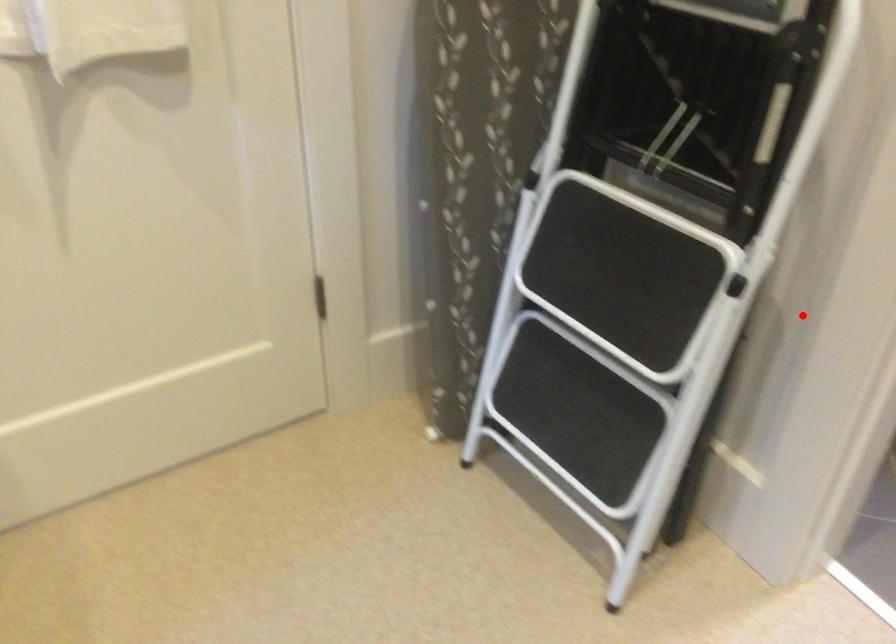
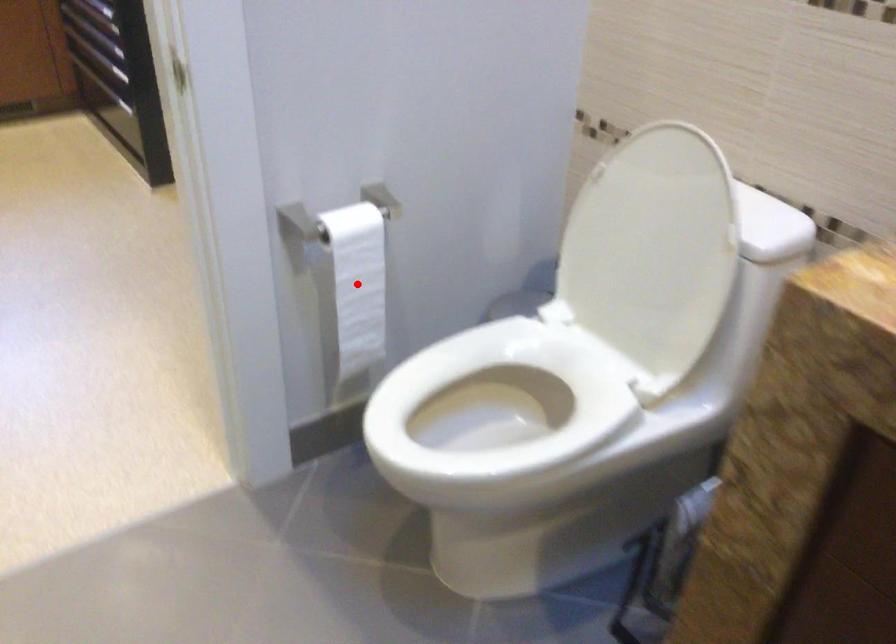
I am providing you with two images of the same scene from different viewpoints. A red point is marked on the first image and another point is marked on the second image. Does the point marked in image1 correspond to the same location as the one in image2?

Yes